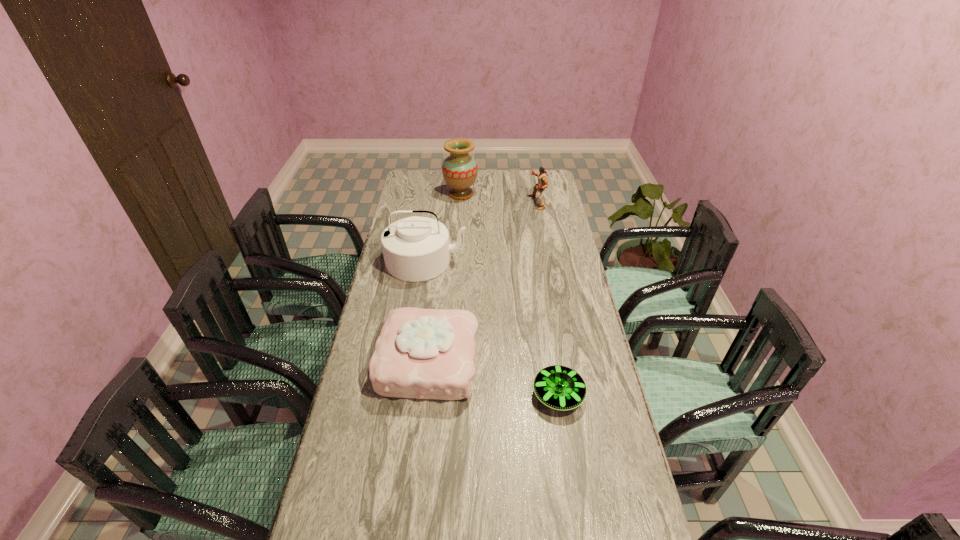
You are a GUI agent. You are given a task and a screenshot of the screen. Output one action in this format:
    pyautogui.click(x=<x>, y=<y>)
    Task: Click on the vacant area between the shortest object and the third shortest object
    The width and height of the screenshot is (960, 540).
    Given the screenshot: What is the action you would take?
    pyautogui.click(x=548, y=299)

The height and width of the screenshot is (540, 960). In order to click on empty space that is in between the third farthest object and the saucer in this screenshot , I will do `click(492, 328)`.

You are a GUI agent. You are given a task and a screenshot of the screen. Output one action in this format:
    pyautogui.click(x=<x>, y=<y>)
    Task: Click on the empty space between the third tallest object and the cake
    The image size is (960, 540).
    Given the screenshot: What is the action you would take?
    pyautogui.click(x=482, y=282)

Locate an element on the screen. Image resolution: width=960 pixels, height=540 pixels. free space between the third nearest object and the saucer is located at coordinates (492, 328).

You are a GUI agent. You are given a task and a screenshot of the screen. Output one action in this format:
    pyautogui.click(x=<x>, y=<y>)
    Task: Click on the empty space between the puncher and the fourth tallest object
    
    Given the screenshot: What is the action you would take?
    click(x=482, y=282)

Find the location of a particular element. The width and height of the screenshot is (960, 540). blank region between the cake and the shortest object is located at coordinates (492, 378).

Identify the location of free space between the puncher and the vase. This screenshot has width=960, height=540. (499, 198).

At what (x,y) coordinates should I click in order to perform the action: click on free space between the third shortest object and the vase. Please return your answer as a coordinate pair (x, y). The width and height of the screenshot is (960, 540). Looking at the image, I should click on (499, 198).

Select which object appears as the fourth closest to the cake. Please provide its 2D coordinates. Your answer should be formatted as a tuple, i.e. [(x, y)], where the tuple contains the x and y coordinates of a point satisfying the conditions above.

[(459, 170)]

I want to click on object that is the third closest to the puncher, so click(x=421, y=353).